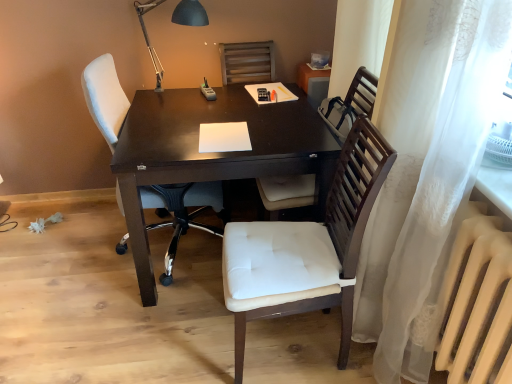
Locate an element on the screen. This screenshot has width=512, height=384. vacant space situated on the left part of white fabric chair at left, which is the third chair from right to left is located at coordinates (66, 252).